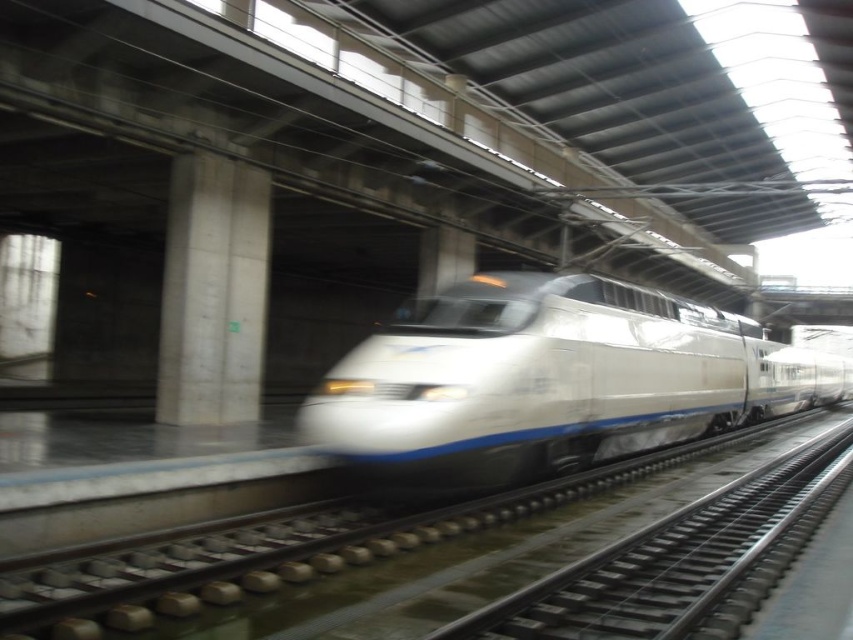
Question: Is white glossy train at center bigger than metal/smooth track at center?

Choices:
 (A) yes
 (B) no

Answer: (A)

Question: Which object is closer to the camera taking this photo?

Choices:
 (A) metal/smooth track at center
 (B) white glossy train at center

Answer: (A)

Question: Is white glossy train at center positioned behind metal/smooth track at center?

Choices:
 (A) yes
 (B) no

Answer: (A)

Question: Does white glossy train at center have a greater width compared to metal/smooth track at center?

Choices:
 (A) yes
 (B) no

Answer: (A)